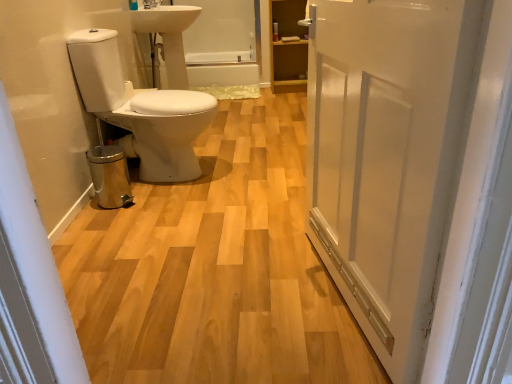
At what (x,y) coordinates should I click in order to perform the action: click on vacant space that's between white matte door at center and white glossy toilet at left. Please return your answer as a coordinate pair (x, y). Looking at the image, I should click on (237, 224).